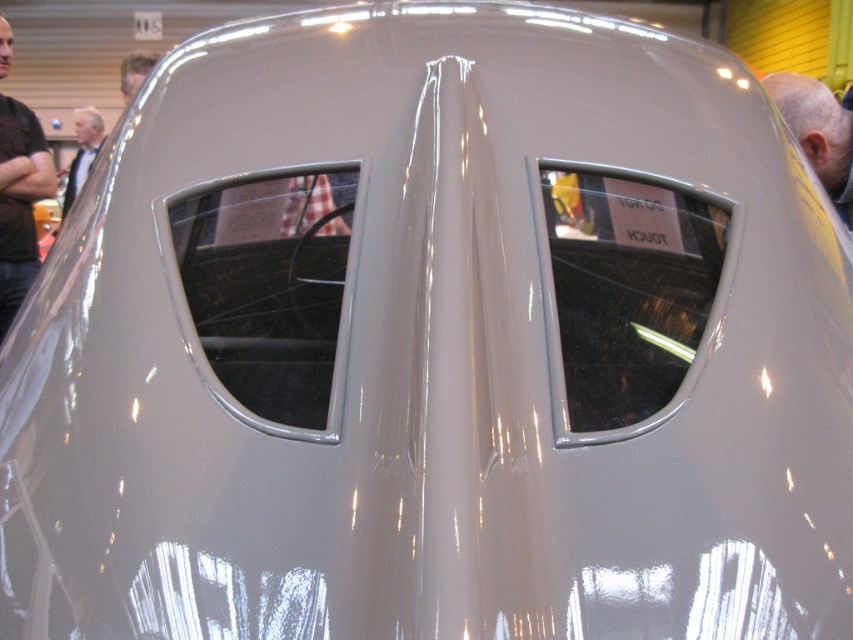
You are a photographer standing in front of the vintage car. You notice a person wearing a light gray suit at left and another person with light brown hair at upper left. Which object takes up more horizontal space in the image?

The light gray suit at left takes up more horizontal space in the image because its width is larger than that of the light brown hair at upper left.

You are a tailor measuring a mannequin for a suit. The mannequin is wearing the light gray suit at left and has light brown hair at upper left. The distance between them is crucial for adjusting the suit. Can the suit be adjusted to fit the mannequin properly if the required minimum distance is 30 inches?

The light gray suit at left is 32.50 inches from the light brown hair at upper left. Since 32.50 inches exceeds the required minimum distance of 30 inches, the suit can be adjusted to fit the mannequin properly.

You are a photographer planning to take a portrait of two people sitting side by side in the front of the vintage car. The gray matte head at upper right and the light brown hair at upper left are the subjects. Given their positions and the car windows, which subject should be placed closer to the central vertical panel to ensure both fit within the frame?

The gray matte head at upper right should be placed closer to the central vertical panel because its width surpasses that of the light brown hair at upper left, allowing more space for the wider subject near the center where the car windows are wider.